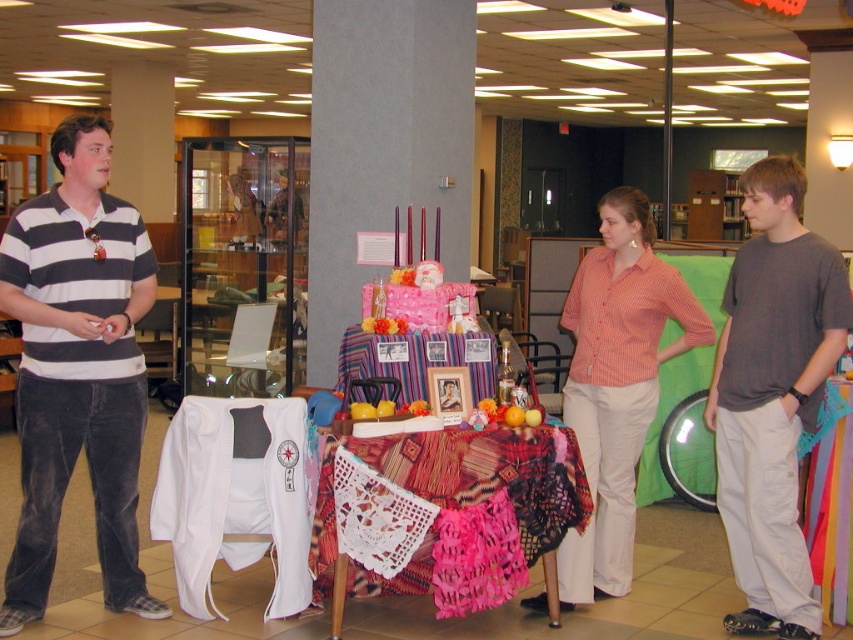
You are organizing a party and need to place a decorative item on the table. The orange checkered shirt at center and the textured woven cloth at center are both on the table. Which one is closer to you if you are standing in front of the table?

The orange checkered shirt at center is closer to you because the textured woven cloth at center is behind it.

From the picture: You are organizing a small event and need to decide which item to use for a display. You have a striped polo shirt at left and a striped fabric tablecloth at center. Which item has a bigger size?

The striped polo shirt at left is larger in size than the striped fabric tablecloth at center, so the striped polo shirt at left is bigger.

What is the exact location of the striped polo shirt at left in the scene?

The striped polo shirt at left is located at point (77, 369).